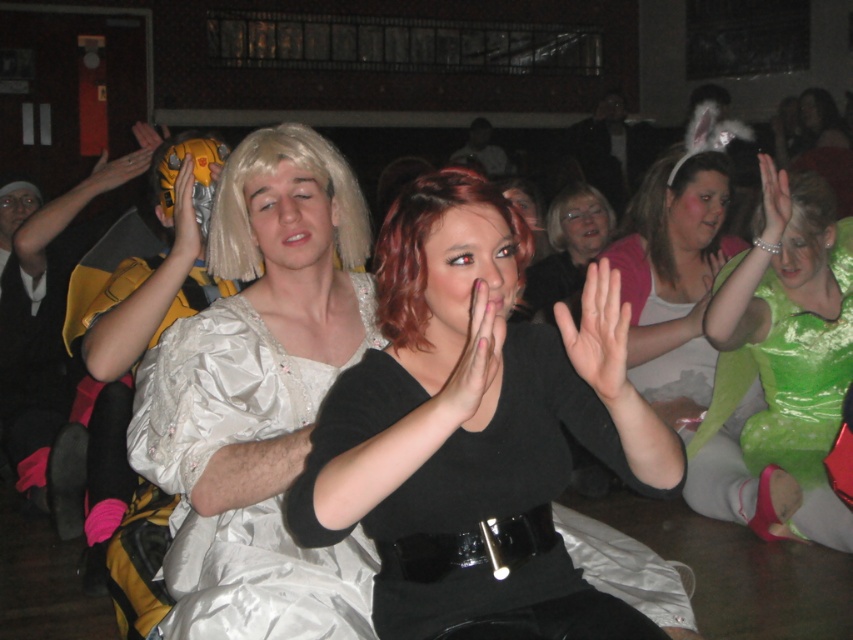
Question: Which point is closer to the camera taking this photo?

Choices:
 (A) (440, 307)
 (B) (554, 221)

Answer: (A)

Question: Is green shiny dress at center bigger than light brown synthetic wig at center?

Choices:
 (A) no
 (B) yes

Answer: (B)

Question: Based on their relative distances, which object is nearer to the matte yellow glove at upper left?

Choices:
 (A) white matte wig at center
 (B) matte black shirt at center
 (C) matte pink shirt at center
 (D) matte yellow robot hand at upper left

Answer: (D)

Question: Is smooth green hand at upper right positioned before white matte wig at center?

Choices:
 (A) yes
 (B) no

Answer: (A)

Question: Which point is farther to the camera?

Choices:
 (A) (552, 202)
 (B) (100, 161)
 (C) (554, 248)
 (D) (781, 182)

Answer: (A)

Question: Does green shiny dress at center appear on the right side of blonde synthetic wig at center?

Choices:
 (A) no
 (B) yes

Answer: (B)